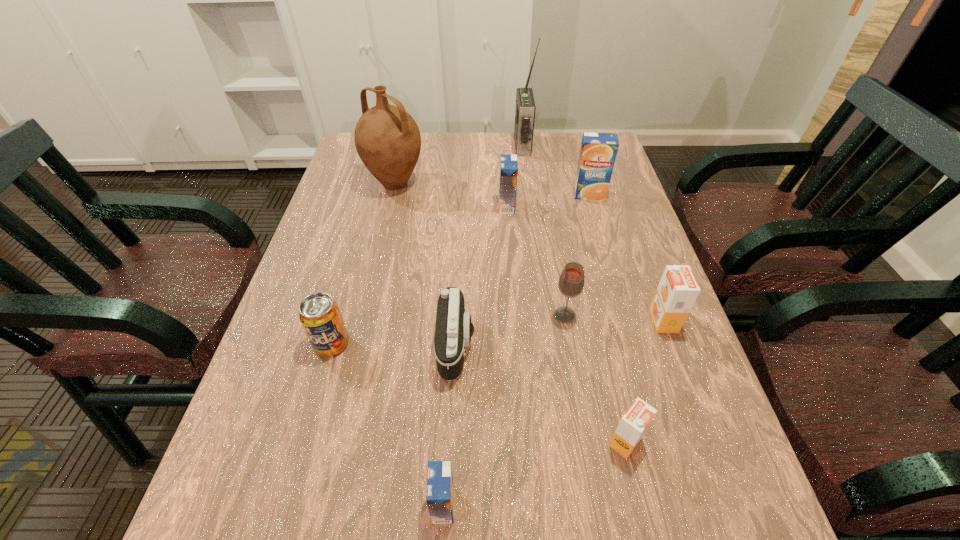
The height and width of the screenshot is (540, 960). I want to click on radio receiver, so click(x=525, y=108).

I want to click on pitcher, so click(x=387, y=139).

The height and width of the screenshot is (540, 960). In order to click on the second tallest object in this screenshot , I will do click(x=387, y=139).

Where is `the biggest blue orange_juice`? This screenshot has height=540, width=960. the biggest blue orange_juice is located at coordinates (598, 152).

The image size is (960, 540). In order to click on the third tallest object in this screenshot , I will do `click(598, 152)`.

Image resolution: width=960 pixels, height=540 pixels. In order to click on glass drink container in this screenshot , I will do [x=571, y=282].

This screenshot has height=540, width=960. Identify the location of the fourth orange_juice from right to left. (508, 173).

At what (x,y) coordinates should I click in order to perform the action: click on the fifth object from left to right. Please return your answer as a coordinate pair (x, y). This screenshot has height=540, width=960. Looking at the image, I should click on (508, 173).

Find the location of a particular element. Image resolution: width=960 pixels, height=540 pixels. the third nearest orange_juice is located at coordinates (678, 289).

Find the location of a particular element. The width and height of the screenshot is (960, 540). the bigger orange orange juice is located at coordinates (678, 289).